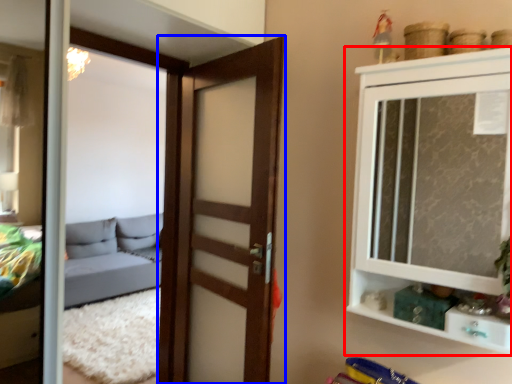
Question: Among these objects, which one is farthest to the camera, cupboard (highlighted by a red box) or door (highlighted by a blue box)?

Choices:
 (A) cupboard
 (B) door

Answer: (B)